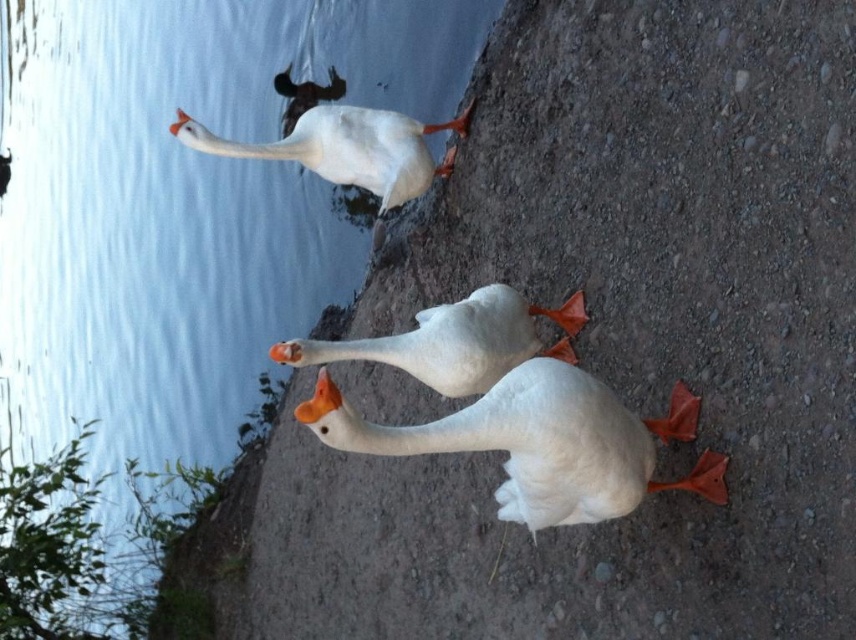
You are a photographer trying to capture the geese in the image. You notice two points of interest marked as point 1 at coordinates (159, 10) and point 2 at coordinates (397, 136). Which point is closer to your camera lens?

Point 1 at coordinates (159, 10) is closer to the camera lens because it is further to the viewer than point 2 at coordinates (397, 136).

You are standing on the rocky shoreline and see the point marked at coordinates (183, 204). What is located at that point?

The point at coordinates (183, 204) is on clear blue water at upper left.